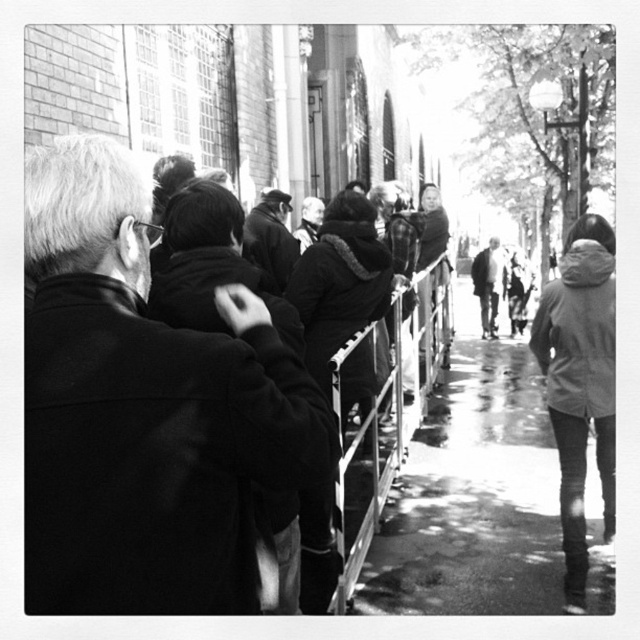
Question: Is black wool coat at center thinner than metallic silver railing at center?

Choices:
 (A) yes
 (B) no

Answer: (B)

Question: Which object appears farthest from the camera in this image?

Choices:
 (A) denim jacket at lower right
 (B) wet asphalt sidewalk at center

Answer: (A)

Question: Is wet asphalt sidewalk at center wider than dark gray coat at center?

Choices:
 (A) no
 (B) yes

Answer: (B)

Question: Which of the following is the closest to the observer?

Choices:
 (A) (77, 234)
 (B) (371, 468)
 (C) (493, 284)
 (D) (396, 493)

Answer: (A)

Question: Which point is farther to the camera?

Choices:
 (A) dark gray coat at center
 (B) denim jacket at lower right

Answer: (A)

Question: Does metallic silver railing at center appear on the right side of dark gray coat at center?

Choices:
 (A) yes
 (B) no

Answer: (B)